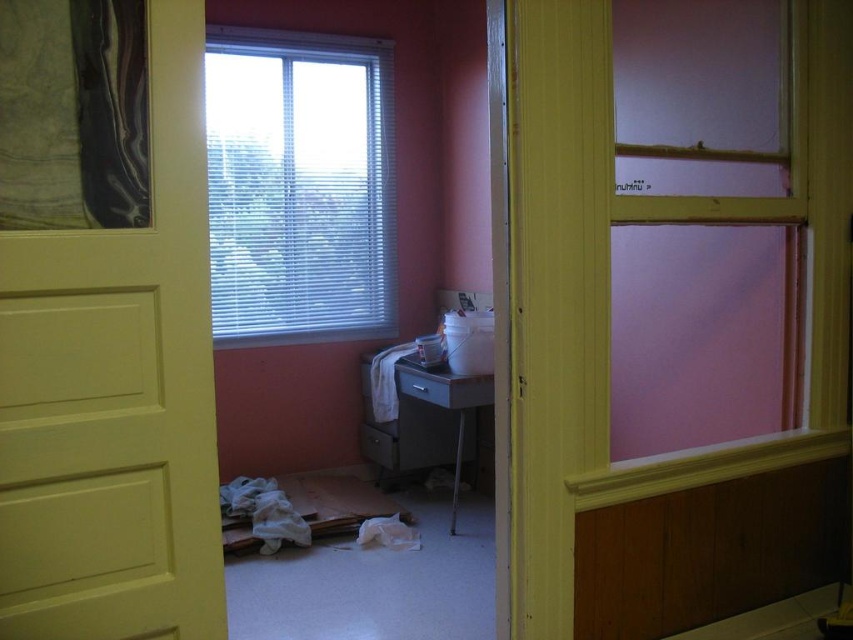
You are trying to decide where to place a new poster. The white blinds at upper center and the black marble painting at upper left are already on the wall. Which object has more space available next to it for the poster?

The white blinds at upper center has more space available next to it because its width is larger than the black marble painting at upper left.

You are a delivery person with a 20 cm wide package. You need to place it between the yellow matte door at center and the black marble painting at upper left. Is there enough space?

The yellow matte door at center is 22.63 centimeters away from the black marble painting at upper left. Since the package is 20 cm wide, there is enough space to place it between them as the distance is greater than the package width.

You are standing in the room with the partially open yellow door. You notice a white bucket on the desk near the window. Can you determine if the white bucket is under the white blinds at upper center located at point (299, 186)?

The white blinds at upper center are located at point (299, 186). Since the desk is positioned near the window, it is likely that the white bucket on the desk is under the white blinds at upper center.